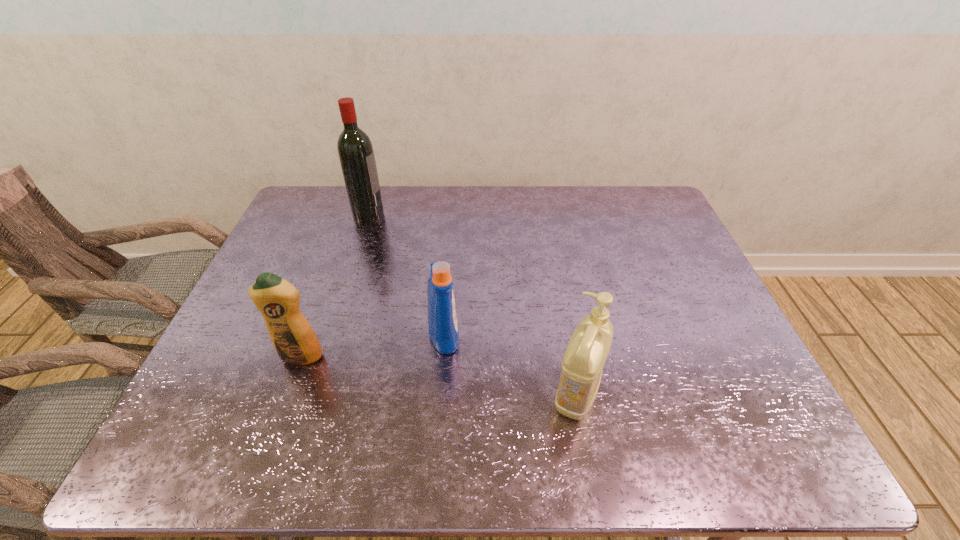
Where is `detergent that is the second closest to the rightmost object`? The height and width of the screenshot is (540, 960). detergent that is the second closest to the rightmost object is located at coordinates (292, 336).

Locate which detergent ranks second in proximity to the leftmost detergent. Please provide its 2D coordinates. Your answer should be formatted as a tuple, i.e. [(x, y)], where the tuple contains the x and y coordinates of a point satisfying the conditions above.

[(582, 365)]

In order to click on free location that satisfies the following two spatial constraints: 1. on the label of the leftmost detergent; 2. on the left side of the rightmost object in this screenshot , I will do `click(287, 394)`.

The image size is (960, 540). In order to click on free space that satisfies the following two spatial constraints: 1. on the label of the second detergent from right to left; 2. on the label of the leftmost detergent in this screenshot , I will do `click(443, 356)`.

Locate an element on the screen. The width and height of the screenshot is (960, 540). free space that satisfies the following two spatial constraints: 1. on the label of the third object from left to right; 2. on the left side of the rightmost object is located at coordinates (440, 394).

This screenshot has height=540, width=960. I want to click on free spot that satisfies the following two spatial constraints: 1. on the back side of the rightmost detergent; 2. on the label of the farthest object, so click(x=544, y=216).

This screenshot has height=540, width=960. What are the coordinates of `vacant space that satisfies the following two spatial constraints: 1. on the label of the second object from right to left; 2. on the label of the leftmost detergent` in the screenshot? It's located at click(x=443, y=356).

You are a GUI agent. You are given a task and a screenshot of the screen. Output one action in this format:
    pyautogui.click(x=<x>, y=<y>)
    Task: Click on the blank area in the image that satisfies the following two spatial constraints: 1. on the label of the third object from left to right; 2. on the left side of the rightmost object
    The image size is (960, 540).
    Given the screenshot: What is the action you would take?
    pyautogui.click(x=440, y=394)

You are a GUI agent. You are given a task and a screenshot of the screen. Output one action in this format:
    pyautogui.click(x=<x>, y=<y>)
    Task: Click on the blank space that satisfies the following two spatial constraints: 1. on the label of the wine bottle; 2. on the right side of the rightmost object
    
    Given the screenshot: What is the action you would take?
    pyautogui.click(x=312, y=394)

Where is `blank area in the image that satisfies the following two spatial constraints: 1. on the label of the leftmost detergent; 2. on the left side of the rightmost object`? The image size is (960, 540). blank area in the image that satisfies the following two spatial constraints: 1. on the label of the leftmost detergent; 2. on the left side of the rightmost object is located at coordinates (287, 394).